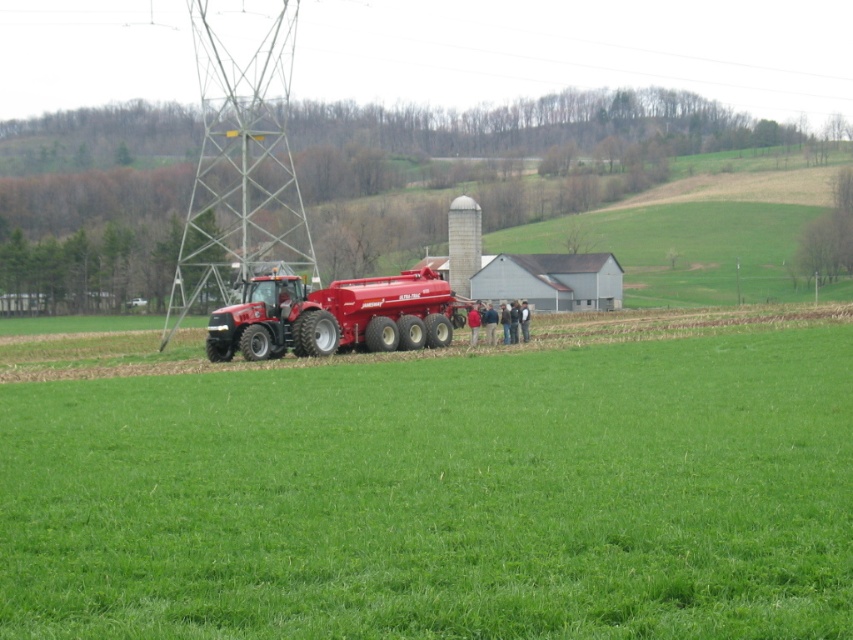
Question: Which point is closer to the camera?

Choices:
 (A) (407, 294)
 (B) (12, 577)

Answer: (B)

Question: Can you confirm if green grassy field at center is positioned below matte red tractor at center?

Choices:
 (A) no
 (B) yes

Answer: (B)

Question: Among these objects, which one is farthest from the camera?

Choices:
 (A) green grassy field at center
 (B) matte red tractor at center

Answer: (B)

Question: Considering the relative positions of green grassy field at center and matte red tractor at center in the image provided, where is green grassy field at center located with respect to matte red tractor at center?

Choices:
 (A) right
 (B) left

Answer: (A)

Question: Does green grassy field at center have a lesser width compared to matte red tractor at center?

Choices:
 (A) no
 (B) yes

Answer: (A)